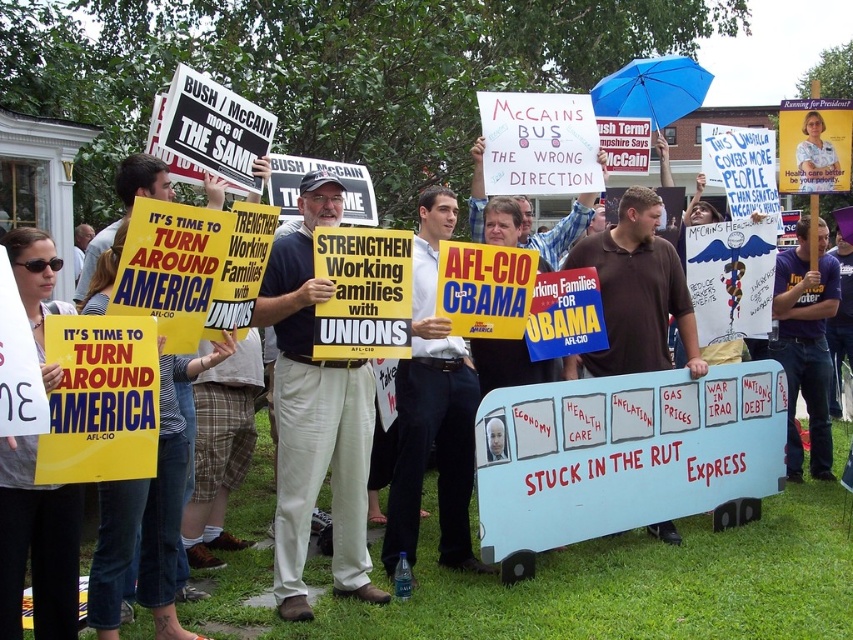
You are a photographer taking a picture of the political rally. You notice a point at coordinates (432, 410). What object is located at this point?

The point at coordinates (432, 410) is located on the white cotton shirt at center.

You are a photographer at the rally and need to capture a clear photo of the white cotton shirt at center and the light beige pants at center. Which clothing item will appear higher in the photo?

The white cotton shirt at center will appear higher in the photo because the light beige pants at center is below it.

You are a photographer at the rally and want to take a photo of the light beige pants at center and the white cotton shirt at center. Which object should you focus on first to ensure both are in focus?

You should focus on the light beige pants at center first since it is closer to the viewer than the white cotton shirt at center, ensuring depth of field captures both.